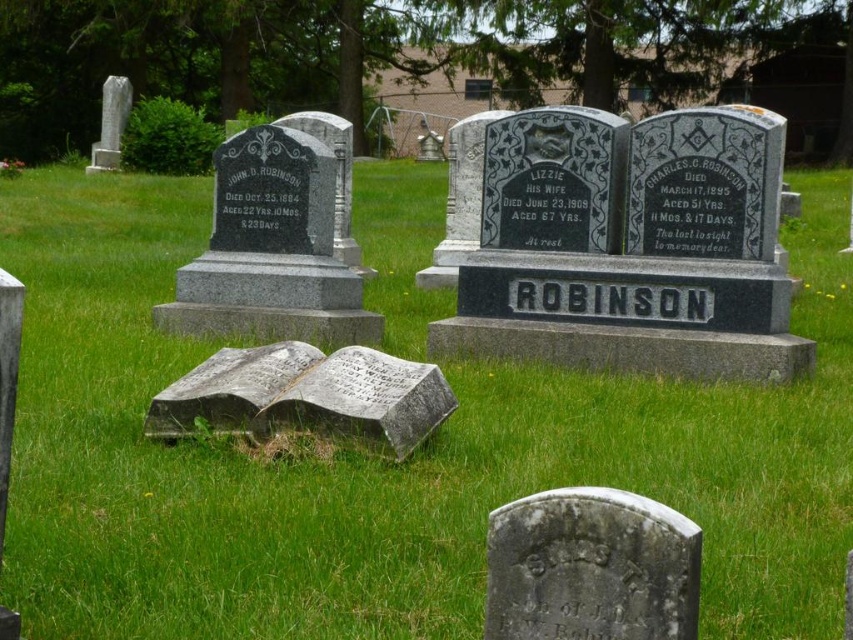
Does gray stone gravestone at lower center appear on the right side of gray stone book at center?

Indeed, gray stone gravestone at lower center is positioned on the right side of gray stone book at center.

Does point (492, 636) come in front of point (415, 364)?

Yes.

Locate an element on the screen. The width and height of the screenshot is (853, 640). gray stone gravestone at lower center is located at coordinates (590, 566).

You are a GUI agent. You are given a task and a screenshot of the screen. Output one action in this format:
    pyautogui.click(x=<x>, y=<y>)
    Task: Click on the gray stone gravestone at lower center
    
    Given the screenshot: What is the action you would take?
    pyautogui.click(x=590, y=566)